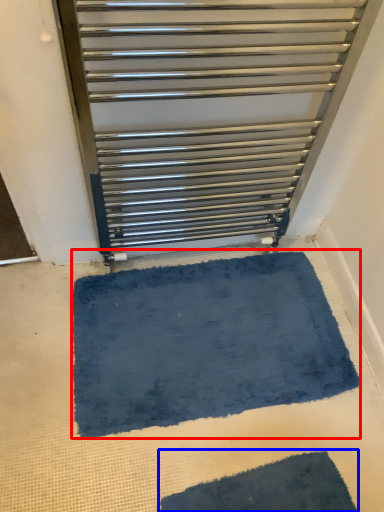
Question: Which point is closer to the camera, bath mat (highlighted by a red box) or bath mat (highlighted by a blue box)?

Choices:
 (A) bath mat
 (B) bath mat

Answer: (B)